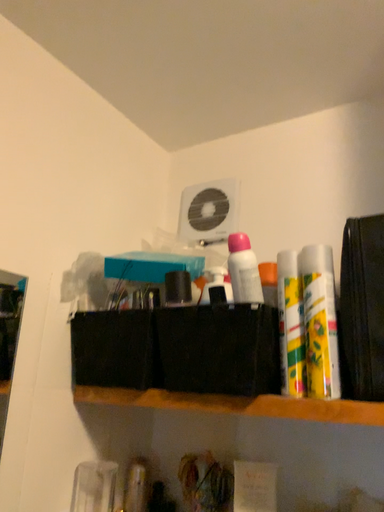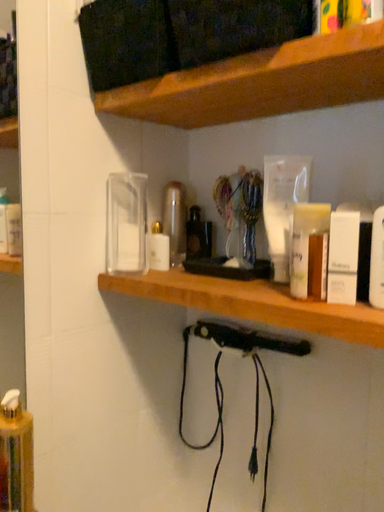
Question: Which way did the camera rotate in the video?

Choices:
 (A) rotated downward
 (B) rotated upward

Answer: (A)